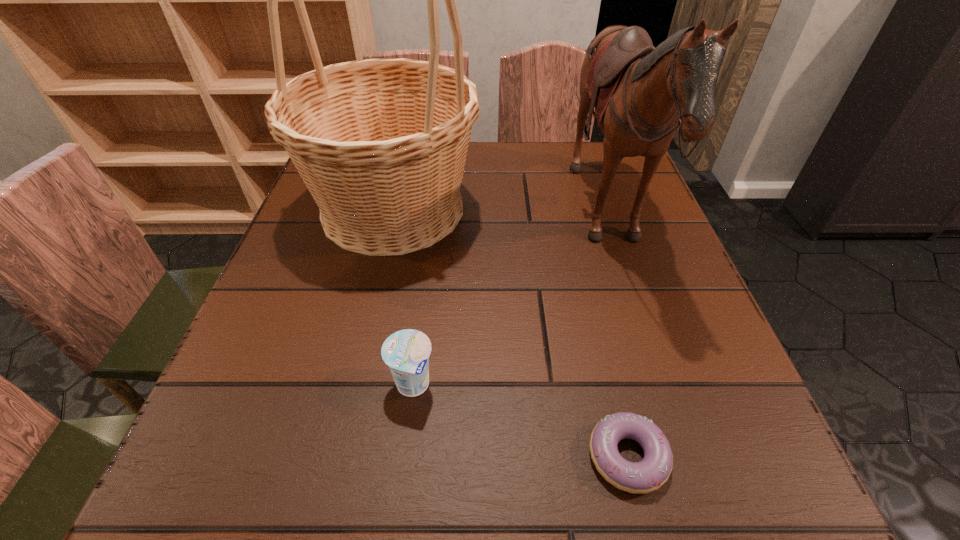
Find the location of a particular element. free space located 0.250m on the right of the second nearest object is located at coordinates (601, 385).

The height and width of the screenshot is (540, 960). Find the location of `vacant space located on the left of the doughnut`. vacant space located on the left of the doughnut is located at coordinates coord(289,456).

Where is `basket that is positioned at the far edge`? The image size is (960, 540). basket that is positioned at the far edge is located at coordinates (381, 144).

Image resolution: width=960 pixels, height=540 pixels. I want to click on saddle situated at the far edge, so click(x=641, y=94).

I want to click on object present at the near edge, so click(649, 474).

Identify the location of object located at the left edge. Image resolution: width=960 pixels, height=540 pixels. (381, 144).

Image resolution: width=960 pixels, height=540 pixels. Find the location of `saddle that is positioned at the right edge`. saddle that is positioned at the right edge is located at coordinates (641, 94).

Locate an element on the screen. This screenshot has width=960, height=540. doughnut at the right edge is located at coordinates (649, 474).

The width and height of the screenshot is (960, 540). In order to click on object located at the far left corner in this screenshot , I will do `click(381, 144)`.

Where is `object at the far right corner`? Image resolution: width=960 pixels, height=540 pixels. object at the far right corner is located at coordinates (641, 94).